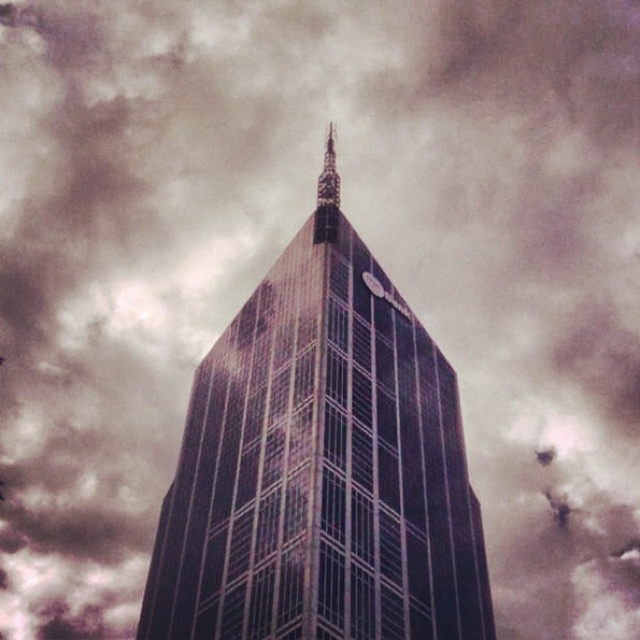
You are an architect analyzing the skyscraper. You notice the shiny glass tower at center and the polished glass spire at center. Which of these two elements is closer to the front of the building?

The shiny glass tower at center is closer to the front of the building than the polished glass spire at center, as it is positioned in front of it.

You are standing at the center of the image. Based on the coordinates given, is the shiny glass tower at center located to your left, right, front, or back?

The shiny glass tower at center is located at the front because its coordinates are at the center point of the image.